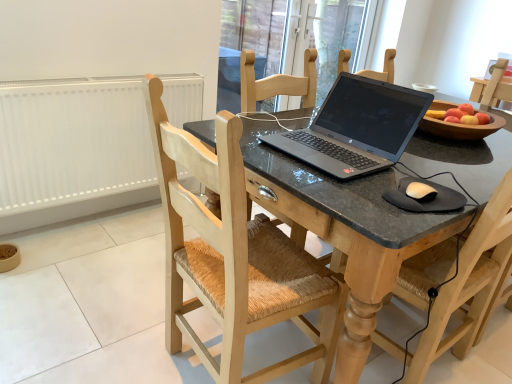
Locate an element on the screen. Image resolution: width=512 pixels, height=384 pixels. vacant space that is to the left of light wood chair at center, which appears as the second chair when viewed from the right is located at coordinates (116, 335).